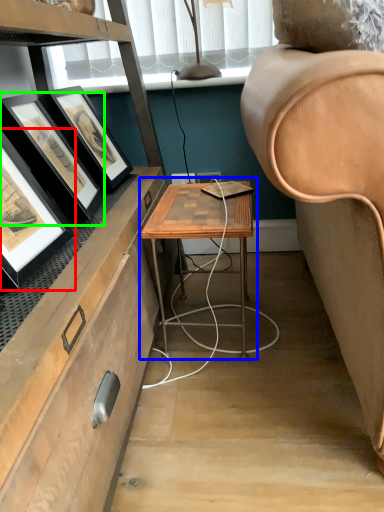
Question: Which object is positioned closest to picture frame (highlighted by a red box)? Select from table (highlighted by a blue box) and picture frame (highlighted by a green box).

Choices:
 (A) table
 (B) picture frame

Answer: (B)